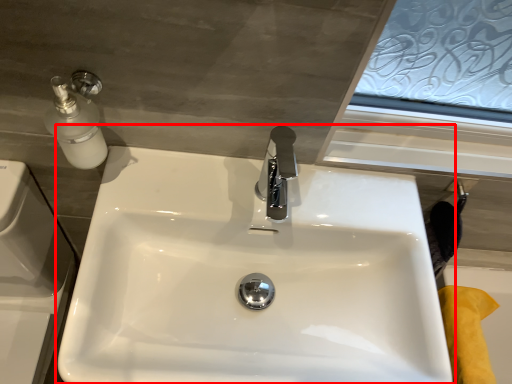
Question: Observing the image, what is the correct spatial positioning of sink (annotated by the red box) in reference to bath?

Choices:
 (A) left
 (B) right

Answer: (A)